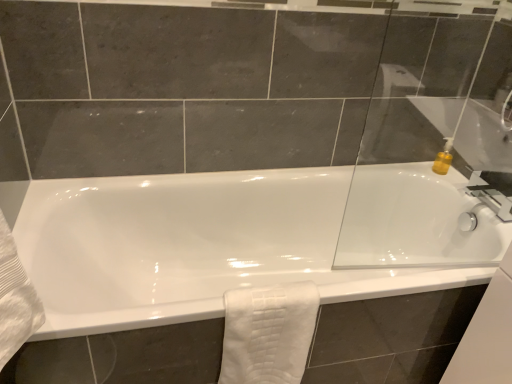
Question: From the image's perspective, would you say transparent glass door at upper right is positioned over white glossy bathtub at center?

Choices:
 (A) yes
 (B) no

Answer: (A)

Question: Can you see transparent glass door at upper right touching white glossy bathtub at center?

Choices:
 (A) yes
 (B) no

Answer: (B)

Question: Is transparent glass door at upper right far away from white glossy bathtub at center?

Choices:
 (A) no
 (B) yes

Answer: (A)

Question: Is transparent glass door at upper right at the left side of white glossy bathtub at center?

Choices:
 (A) no
 (B) yes

Answer: (A)

Question: From the image's perspective, would you say transparent glass door at upper right is shown under white glossy bathtub at center?

Choices:
 (A) no
 (B) yes

Answer: (A)

Question: Can you confirm if transparent glass door at upper right is smaller than white glossy bathtub at center?

Choices:
 (A) no
 (B) yes

Answer: (B)

Question: From the image's perspective, would you say transparent glass door at upper right is positioned over white textured towel at lower center?

Choices:
 (A) no
 (B) yes

Answer: (B)

Question: Is white textured towel at lower center completely or partially inside transparent glass door at upper right?

Choices:
 (A) no
 (B) yes

Answer: (A)

Question: Is transparent glass door at upper right further to the viewer compared to white textured towel at lower center?

Choices:
 (A) yes
 (B) no

Answer: (B)

Question: Does transparent glass door at upper right appear on the right side of white textured towel at lower center?

Choices:
 (A) no
 (B) yes

Answer: (B)

Question: From the image's perspective, would you say transparent glass door at upper right is shown under white textured towel at lower center?

Choices:
 (A) no
 (B) yes

Answer: (A)

Question: Does transparent glass door at upper right have a greater width compared to white textured towel at lower center?

Choices:
 (A) yes
 (B) no

Answer: (B)

Question: Can you confirm if white glossy bathtub at center is positioned to the left of white textured towel at lower center?

Choices:
 (A) no
 (B) yes

Answer: (A)